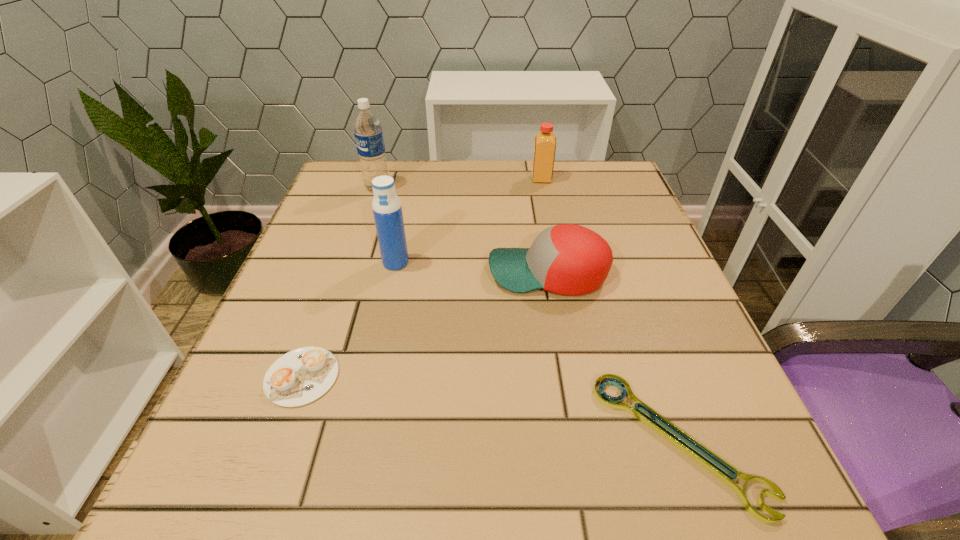
The image size is (960, 540). I want to click on water bottle present at the left edge, so click(x=367, y=128).

This screenshot has width=960, height=540. Identify the location of cappuccino situated at the left edge. (301, 376).

At what (x,y) coordinates should I click in order to perform the action: click on baseball cap present at the right edge. Please return your answer as a coordinate pair (x, y). Looking at the image, I should click on (568, 259).

Image resolution: width=960 pixels, height=540 pixels. I want to click on wrench located at the right edge, so click(606, 400).

Where is `object that is at the far left corner`? The image size is (960, 540). object that is at the far left corner is located at coordinates (367, 128).

Find the location of a particular element. Image resolution: width=960 pixels, height=540 pixels. object that is positioned at the near right corner is located at coordinates (606, 400).

Find the location of a particular element. free space at the far edge is located at coordinates (428, 185).

Locate an element on the screen. Image resolution: width=960 pixels, height=540 pixels. free space at the near edge of the desktop is located at coordinates (324, 477).

What are the coordinates of `free space at the left edge` in the screenshot? It's located at (247, 396).

Identify the location of vacant area at the right edge of the desktop. (645, 319).